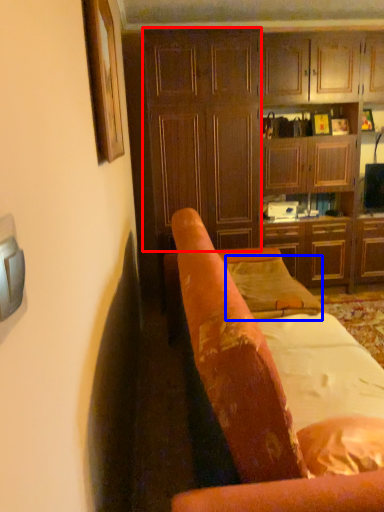
Question: Which of the following is the closest to the observer, dresser (highlighted by a red box) or pillow (highlighted by a blue box)?

Choices:
 (A) dresser
 (B) pillow

Answer: (B)